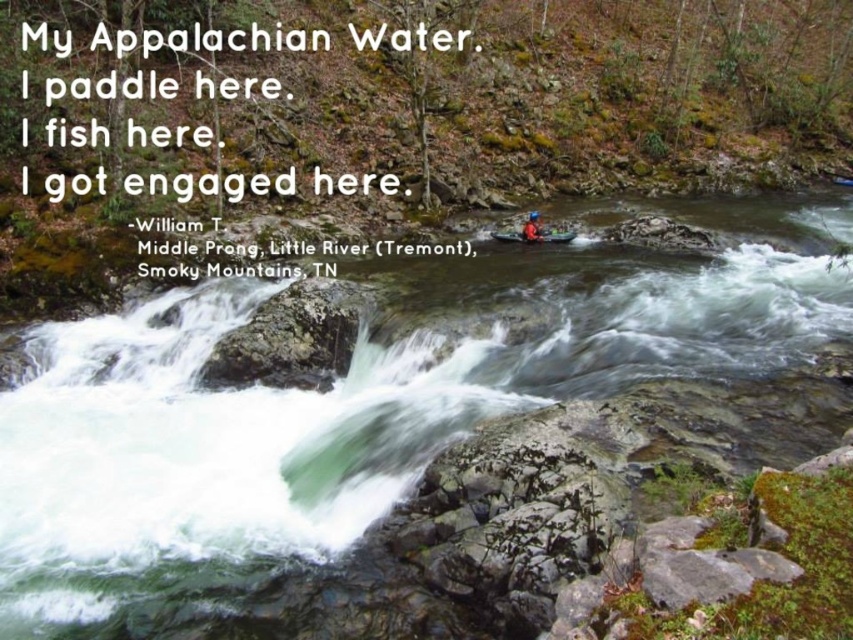
Who is lower down, matte red kayak at center or orange fabric kayak at upper right?

matte red kayak at center is lower down.

Is matte red kayak at center thinner than orange fabric kayak at upper right?

Incorrect, matte red kayak at center's width is not less than orange fabric kayak at upper right's.

Is point (556, 230) positioned behind point (535, 216)?

No.

The width and height of the screenshot is (853, 640). Identify the location of matte red kayak at center. (535, 236).

Between white frothy water at center and matte red kayak at center, which one has more height?

Standing taller between the two is white frothy water at center.

Can you confirm if white frothy water at center is positioned to the left of matte red kayak at center?

No, white frothy water at center is not to the left of matte red kayak at center.

The height and width of the screenshot is (640, 853). I want to click on white frothy water at center, so click(x=357, y=404).

Where is `white frothy water at center`? This screenshot has width=853, height=640. white frothy water at center is located at coordinates (357, 404).

Which of these two, white frothy water at center or orange fabric kayak at upper right, stands shorter?

orange fabric kayak at upper right

Is white frothy water at center thinner than orange fabric kayak at upper right?

No.

Where is `white frothy water at center`? This screenshot has height=640, width=853. white frothy water at center is located at coordinates (357, 404).